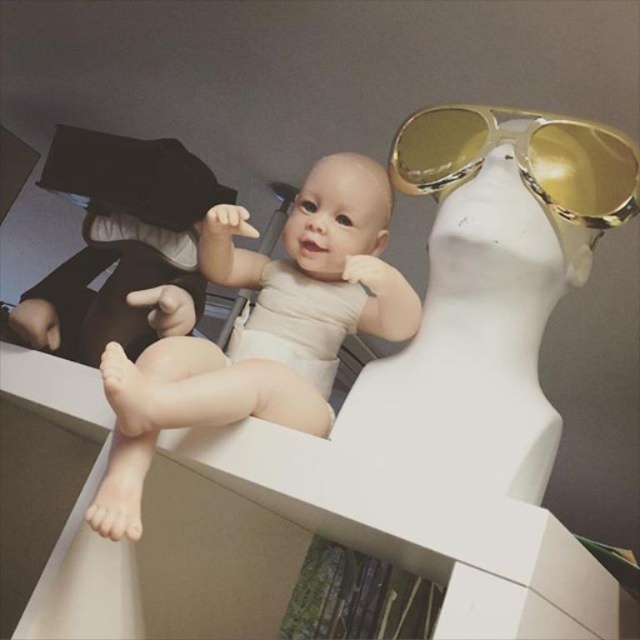
Question: Which of the following is the farthest from the observer?

Choices:
 (A) (397, 150)
 (B) (141, 401)

Answer: (A)

Question: Does smooth beige baby at center appear on the left side of gold reflective sunglasses at upper right?

Choices:
 (A) no
 (B) yes

Answer: (B)

Question: In this image, where is smooth beige baby at center located relative to gold reflective sunglasses at upper right?

Choices:
 (A) below
 (B) above

Answer: (A)

Question: Is smooth beige baby at center below gold reflective sunglasses at upper right?

Choices:
 (A) no
 (B) yes

Answer: (B)

Question: Which object appears farthest from the camera in this image?

Choices:
 (A) smooth beige baby at center
 (B) gold reflective sunglasses at upper right

Answer: (B)